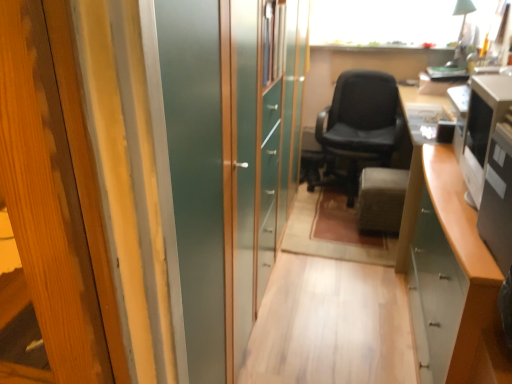
Question: Is satin silver monitor at right, positioned as the 1th desktop computer in back-to-front order, behind black leather chair at center?

Choices:
 (A) yes
 (B) no

Answer: (B)

Question: Considering the relative positions of satin silver monitor at right, positioned as the 1th desktop computer in back-to-front order, and black leather chair at center in the image provided, is satin silver monitor at right, positioned as the 1th desktop computer in back-to-front order, to the right of black leather chair at center from the viewer's perspective?

Choices:
 (A) yes
 (B) no

Answer: (A)

Question: Considering the relative sizes of satin silver monitor at right, positioned as the 1th desktop computer in back-to-front order, and black leather chair at center in the image provided, is satin silver monitor at right, positioned as the 1th desktop computer in back-to-front order, taller than black leather chair at center?

Choices:
 (A) no
 (B) yes

Answer: (A)

Question: Does satin silver monitor at right, the 2th desktop computer viewed from the front, lie in front of black leather chair at center?

Choices:
 (A) no
 (B) yes

Answer: (B)

Question: Does satin silver monitor at right, the 2th desktop computer viewed from the front, have a greater width compared to black leather chair at center?

Choices:
 (A) yes
 (B) no

Answer: (B)

Question: Looking at their shapes, would you say velvet gray ottoman at center is wider or thinner than black glossy desktop computer at right, which is counted as the 2th desktop computer, starting from the back?

Choices:
 (A) wide
 (B) thin

Answer: (A)

Question: Choose the correct answer: Is velvet gray ottoman at center inside black glossy desktop computer at right, which is counted as the 2th desktop computer, starting from the back, or outside it?

Choices:
 (A) outside
 (B) inside

Answer: (A)

Question: Is velvet gray ottoman at center taller or shorter than black glossy desktop computer at right, which is counted as the 2th desktop computer, starting from the back?

Choices:
 (A) tall
 (B) short

Answer: (A)

Question: Does point (408, 175) appear closer or farther from the camera than point (492, 233)?

Choices:
 (A) farther
 (B) closer

Answer: (A)

Question: Relative to black glossy desktop computer at right, which is counted as the 2th desktop computer, starting from the back, is satin silver monitor at right, positioned as the 1th desktop computer in back-to-front order, in front or behind?

Choices:
 (A) behind
 (B) front

Answer: (A)

Question: Based on their positions, is satin silver monitor at right, positioned as the 1th desktop computer in back-to-front order, located to the left or right of black glossy desktop computer at right, which is the 1th desktop computer in front-to-back order?

Choices:
 (A) left
 (B) right

Answer: (B)

Question: From a real-world perspective, is satin silver monitor at right, the 2th desktop computer viewed from the front, above or below black glossy desktop computer at right, which is the 1th desktop computer in front-to-back order?

Choices:
 (A) above
 (B) below

Answer: (A)

Question: Is satin silver monitor at right, positioned as the 1th desktop computer in back-to-front order, spatially inside black glossy desktop computer at right, which is counted as the 2th desktop computer, starting from the back, or outside of it?

Choices:
 (A) inside
 (B) outside

Answer: (B)

Question: Choose the correct answer: Is black glossy desktop computer at right, which is counted as the 2th desktop computer, starting from the back, inside satin silver monitor at right, positioned as the 1th desktop computer in back-to-front order, or outside it?

Choices:
 (A) inside
 (B) outside

Answer: (B)

Question: In terms of width, does black glossy desktop computer at right, which is counted as the 2th desktop computer, starting from the back, look wider or thinner when compared to satin silver monitor at right, positioned as the 1th desktop computer in back-to-front order?

Choices:
 (A) thin
 (B) wide

Answer: (A)